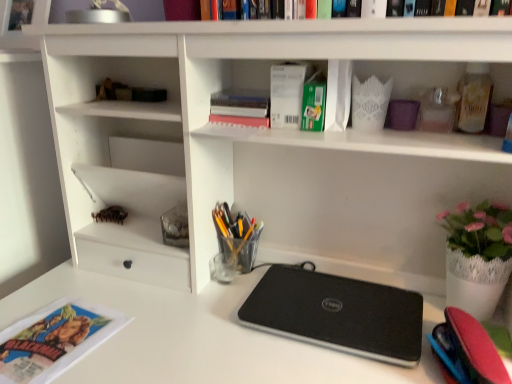
Question: Which direction should I rotate to look at green matte paperback book at upper center, positioned as the first paperback book in right-to-left order?

Choices:
 (A) left
 (B) right

Answer: (B)

Question: Are translucent plastic cup at center and matte paper magazine at lower left beside each other?

Choices:
 (A) yes
 (B) no

Answer: (B)

Question: Does translucent plastic cup at center have a smaller size compared to matte paper magazine at lower left?

Choices:
 (A) yes
 (B) no

Answer: (B)

Question: Is translucent plastic cup at center bigger than matte paper magazine at lower left?

Choices:
 (A) no
 (B) yes

Answer: (B)

Question: Is translucent plastic cup at center positioned behind matte paper magazine at lower left?

Choices:
 (A) yes
 (B) no

Answer: (A)

Question: Can you confirm if translucent plastic cup at center is taller than matte paper magazine at lower left?

Choices:
 (A) yes
 (B) no

Answer: (A)

Question: Does translucent plastic cup at center turn towards matte paper magazine at lower left?

Choices:
 (A) yes
 (B) no

Answer: (B)

Question: Is translucent plastic cup at center at the back of black matte laptop at center?

Choices:
 (A) no
 (B) yes

Answer: (A)

Question: Does black matte laptop at center have a greater height compared to translucent plastic cup at center?

Choices:
 (A) yes
 (B) no

Answer: (B)

Question: Can you confirm if black matte laptop at center is wider than translucent plastic cup at center?

Choices:
 (A) no
 (B) yes

Answer: (B)

Question: From the image's perspective, is black matte laptop at center below translucent plastic cup at center?

Choices:
 (A) no
 (B) yes

Answer: (B)

Question: Considering the relative positions of black matte laptop at center and translucent plastic cup at center in the image provided, is black matte laptop at center to the right of translucent plastic cup at center from the viewer's perspective?

Choices:
 (A) no
 (B) yes

Answer: (B)

Question: Is translucent plastic cup at center surrounded by black matte laptop at center?

Choices:
 (A) yes
 (B) no

Answer: (B)

Question: Is black matte laptop at center thinner than pink matte book at upper center?

Choices:
 (A) no
 (B) yes

Answer: (A)